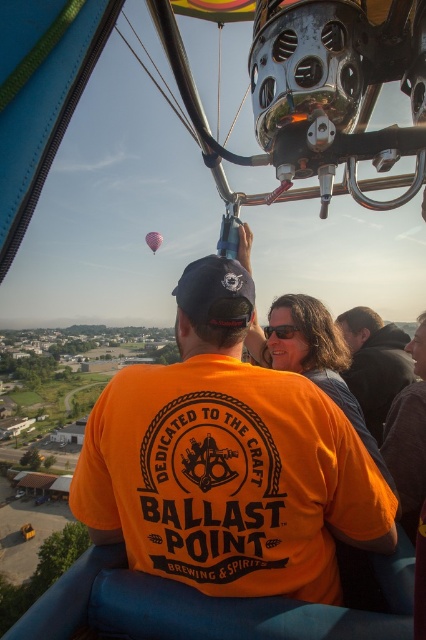
You are a passenger in the hot air balloon basket and need to reach the black fuzzy jacket at upper right. Based on your position facing forward, which direction should you look to find it?

The black fuzzy jacket at upper right is located at point 0.569 in the x coordinate and 0.880 in the y coordinate. Since you are facing forward, the jacket is to your upper right direction.

You are a passenger in the hot air balloon basket. You notice the orange cotton shirt at center and the pink fabric balloon at upper center. Which object is located higher in the basket?

The pink fabric balloon at upper center is higher than the orange cotton shirt at center because it is positioned above it.